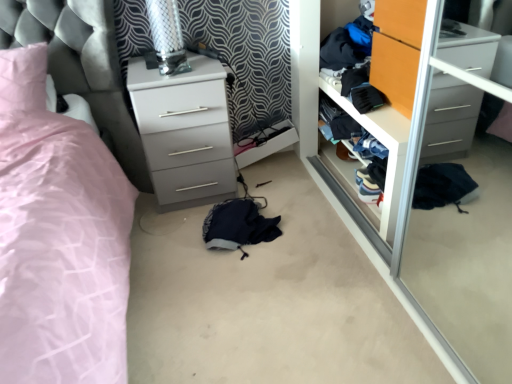
I want to click on vacant point above wooden closet door at center (from a real-world perspective), so click(x=362, y=105).